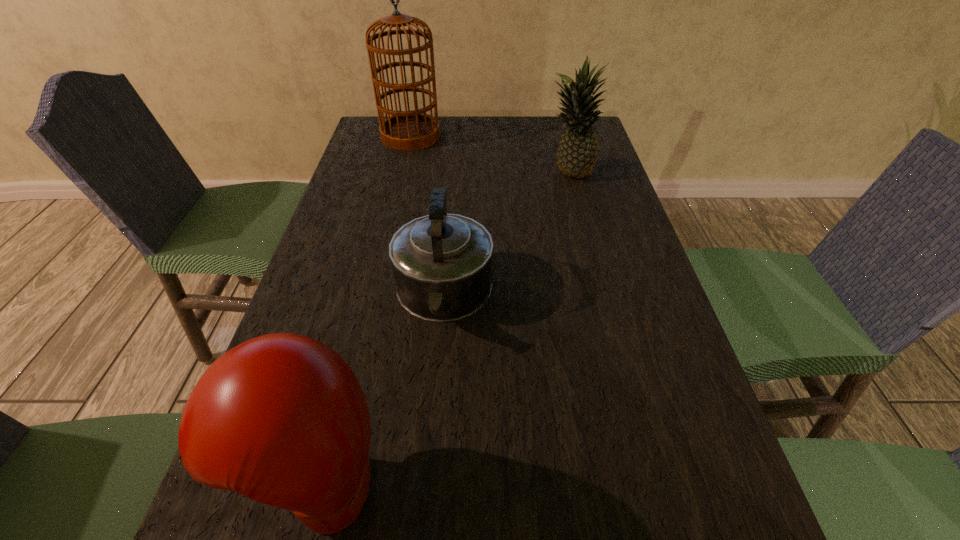
This screenshot has width=960, height=540. In order to click on empty space between the birdcage and the rightmost object in this screenshot , I will do `click(490, 155)`.

Locate an element on the screen. vacant area between the farthest object and the rightmost object is located at coordinates (490, 155).

Choose which object is the third nearest neighbor to the tallest object. Please provide its 2D coordinates. Your answer should be formatted as a tuple, i.e. [(x, y)], where the tuple contains the x and y coordinates of a point satisfying the conditions above.

[(281, 418)]

Identify the location of the second closest object to the birdcage. The height and width of the screenshot is (540, 960). (442, 263).